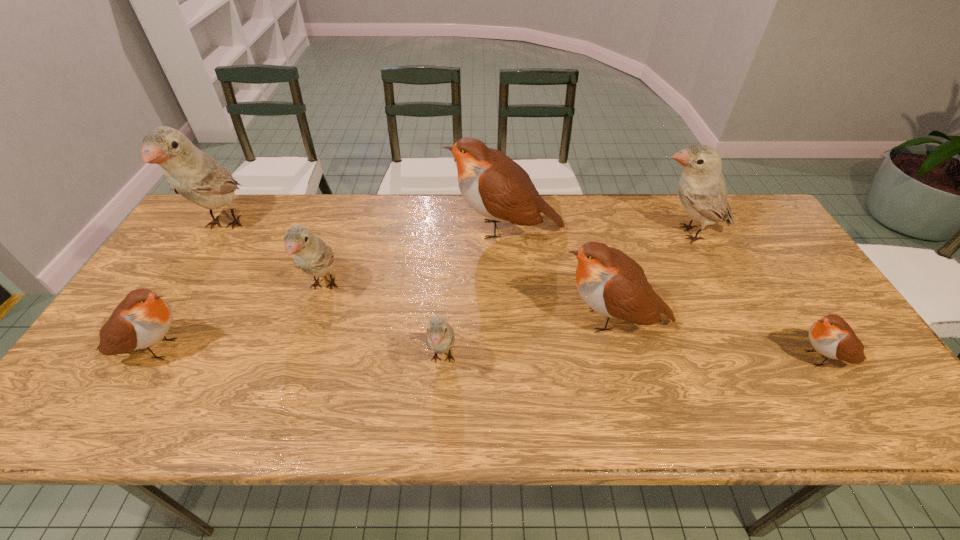
I want to click on the tallest object, so click(x=190, y=172).

What are the coordinates of `the biggest white bird` in the screenshot? It's located at (190, 172).

The width and height of the screenshot is (960, 540). What are the coordinates of `the farthest brown bird` in the screenshot? It's located at (495, 186).

The image size is (960, 540). I want to click on the rightmost white bird, so click(702, 189).

The height and width of the screenshot is (540, 960). I want to click on the third smallest brown bird, so click(x=611, y=283).

This screenshot has width=960, height=540. What are the coordinates of `the second smallest white bird` in the screenshot? It's located at (310, 253).

This screenshot has height=540, width=960. I want to click on the second nearest white bird, so click(310, 253).

Where is `the third biggest brown bird`? the third biggest brown bird is located at coordinates (142, 319).

This screenshot has height=540, width=960. Find the location of `the nearest white bird`. the nearest white bird is located at coordinates (440, 337).

Find the location of a particular element. the smallest white bird is located at coordinates (440, 337).